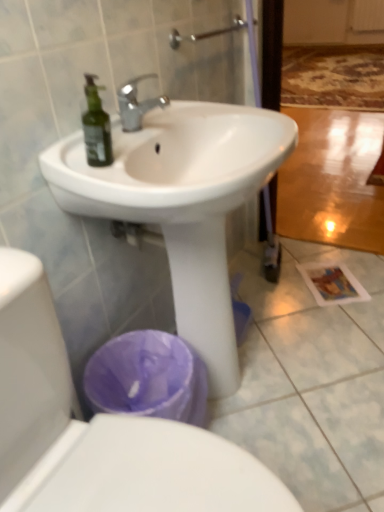
Question: Can you see white glossy sink at center touching white glossy toilet at lower left?

Choices:
 (A) yes
 (B) no

Answer: (B)

Question: Is white glossy sink at center shorter than white glossy toilet at lower left?

Choices:
 (A) no
 (B) yes

Answer: (A)

Question: Can you confirm if white glossy sink at center is smaller than white glossy toilet at lower left?

Choices:
 (A) yes
 (B) no

Answer: (B)

Question: Is white glossy sink at center aimed at white glossy toilet at lower left?

Choices:
 (A) yes
 (B) no

Answer: (B)

Question: From the image's perspective, is white glossy sink at center below white glossy toilet at lower left?

Choices:
 (A) yes
 (B) no

Answer: (B)

Question: Considering the relative sizes of white glossy sink at center and white glossy toilet at lower left in the image provided, is white glossy sink at center thinner than white glossy toilet at lower left?

Choices:
 (A) yes
 (B) no

Answer: (A)

Question: From the image's perspective, does white glossy toilet at lower left appear higher than white glossy sink at center?

Choices:
 (A) no
 (B) yes

Answer: (A)

Question: Is white glossy toilet at lower left aimed at white glossy sink at center?

Choices:
 (A) no
 (B) yes

Answer: (A)

Question: Is white glossy toilet at lower left completely or partially outside of white glossy sink at center?

Choices:
 (A) no
 (B) yes

Answer: (B)

Question: Does white glossy toilet at lower left have a smaller size compared to white glossy sink at center?

Choices:
 (A) yes
 (B) no

Answer: (A)

Question: Is white glossy toilet at lower left wider than white glossy sink at center?

Choices:
 (A) yes
 (B) no

Answer: (A)

Question: Does white glossy toilet at lower left come behind white glossy sink at center?

Choices:
 (A) yes
 (B) no

Answer: (B)

Question: From a real-world perspective, is white glossy sink at center above or below white glossy toilet at lower left?

Choices:
 (A) above
 (B) below

Answer: (A)